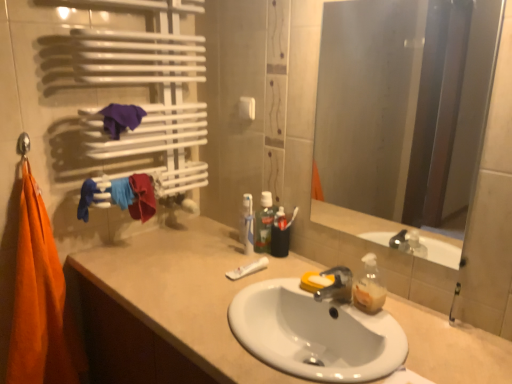
At what (x,y) coordinates should I click in order to perform the action: click on vacant area in front of translucent plastic toothpaste at center. Please return your answer as a coordinate pair (x, y). The height and width of the screenshot is (384, 512). Looking at the image, I should click on (259, 277).